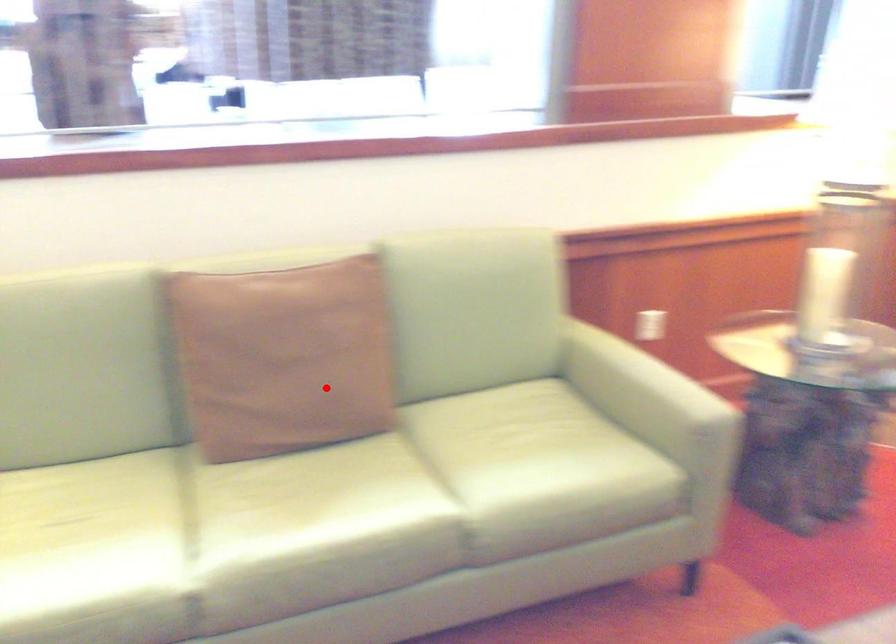
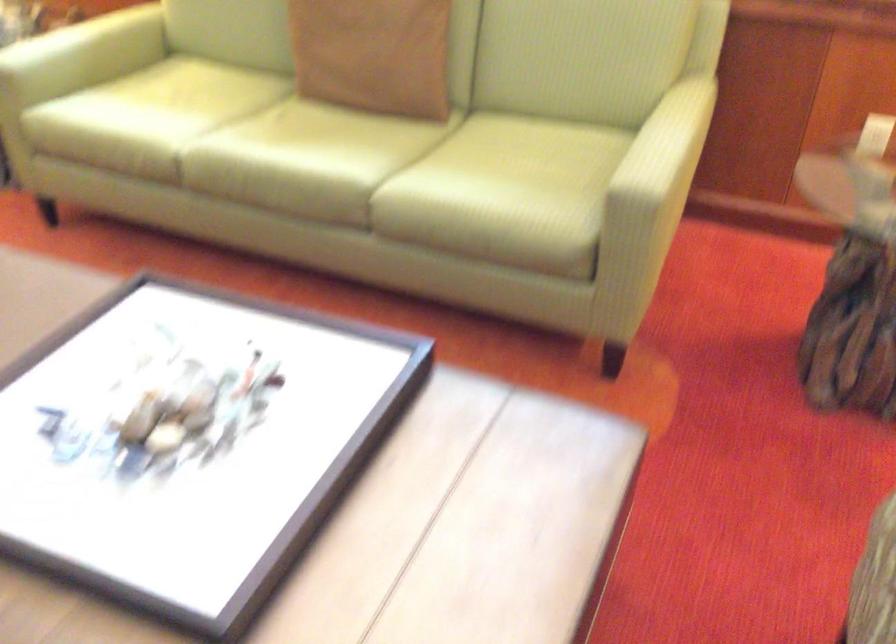
Find the pixel in the second image that matches the highlighted location in the first image.

(373, 55)